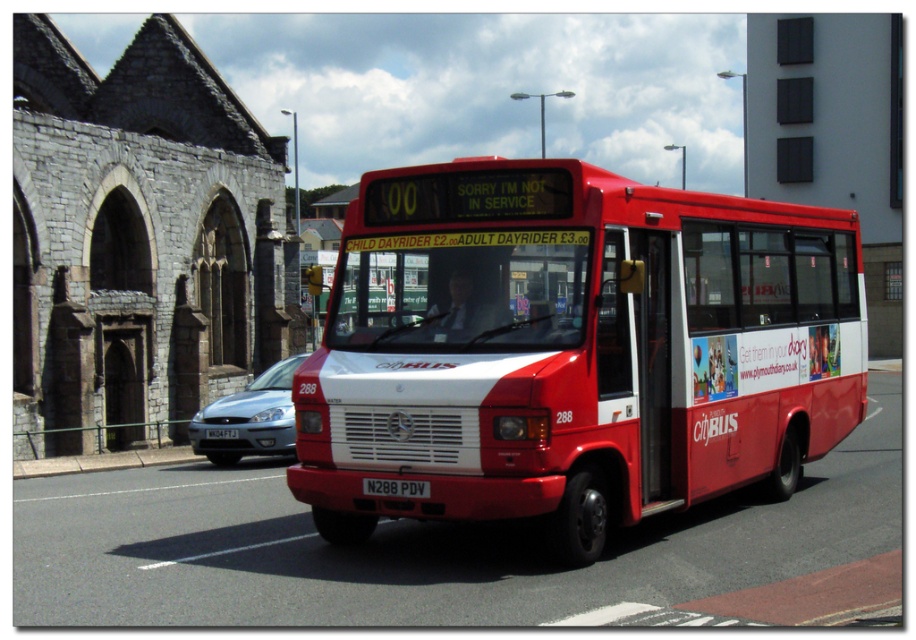
Question: Which object appears closest to the camera in this image?

Choices:
 (A) metallic silver car at center-left
 (B) gray stone church at center
 (C) white plastic license plate at center
 (D) red matte bus at center

Answer: (D)

Question: Can you confirm if black plastic license plate at center is positioned above white plastic license plate at center?

Choices:
 (A) yes
 (B) no

Answer: (A)

Question: Which of these objects is positioned closest to the metallic silver car at center-left?

Choices:
 (A) red matte bus at center
 (B) gray stone church at center
 (C) black plastic license plate at center

Answer: (A)

Question: Which of the following is the closest to the observer?

Choices:
 (A) white plastic license plate at center
 (B) red matte bus at center
 (C) black plastic license plate at center
 (D) gray stone church at center

Answer: (B)

Question: From the image, what is the correct spatial relationship of gray stone church at center in relation to metallic silver car at center-left?

Choices:
 (A) below
 (B) above

Answer: (B)

Question: Where is gray stone church at center located in relation to metallic silver car at center-left in the image?

Choices:
 (A) above
 (B) below

Answer: (A)